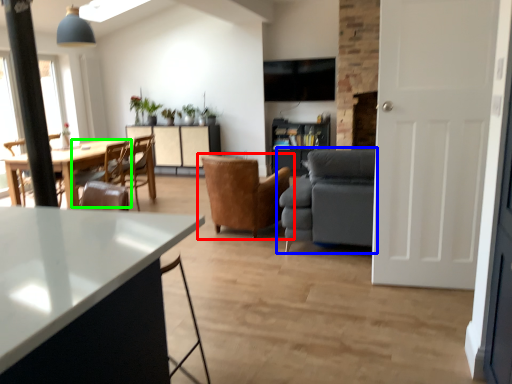
Question: Considering the real-world distances, which object is farthest from chair (highlighted by a red box)? studio couch (highlighted by a blue box) or chair (highlighted by a green box)?

Choices:
 (A) studio couch
 (B) chair

Answer: (B)